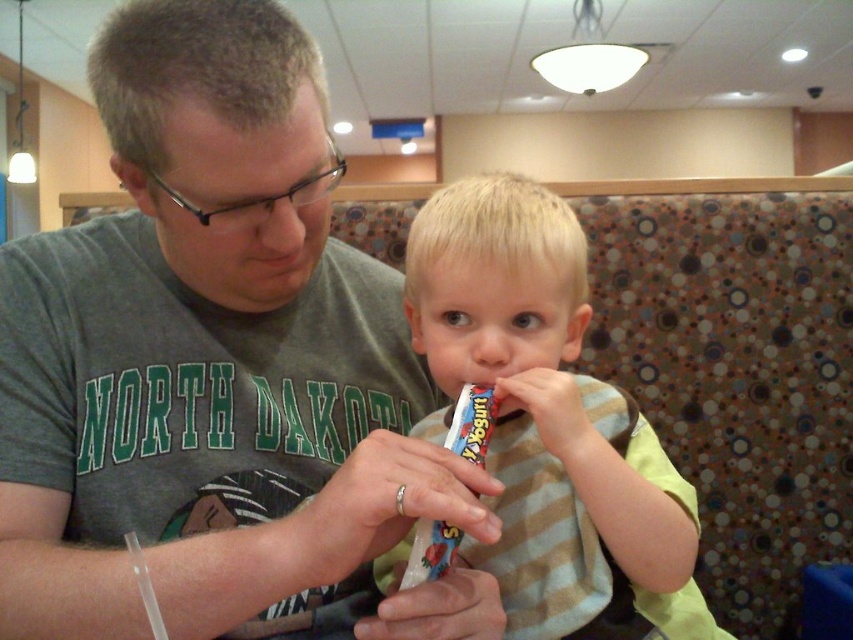
Is gray matte shirt at center below matte plastic yogurt at center?

Incorrect, gray matte shirt at center is not positioned below matte plastic yogurt at center.

At what (x,y) coordinates should I click in order to perform the action: click on gray matte shirt at center. Please return your answer as a coordinate pair (x, y). This screenshot has width=853, height=640. Looking at the image, I should click on (206, 353).

Is gray matte shirt at center positioned in front of multicolored plastic toothbrush at center?

Yes, it is in front of multicolored plastic toothbrush at center.

Can you confirm if gray matte shirt at center is positioned below multicolored plastic toothbrush at center?

No, gray matte shirt at center is not below multicolored plastic toothbrush at center.

Locate an element on the screen. The height and width of the screenshot is (640, 853). gray matte shirt at center is located at coordinates (206, 353).

Is matte plastic yogurt at center closer to camera compared to multicolored plastic toothbrush at center?

Yes, matte plastic yogurt at center is in front of multicolored plastic toothbrush at center.

Which is in front, point (607, 400) or point (453, 410)?

Point (607, 400) is in front.

Identify the location of matte plastic yogurt at center. Image resolution: width=853 pixels, height=640 pixels. (549, 420).